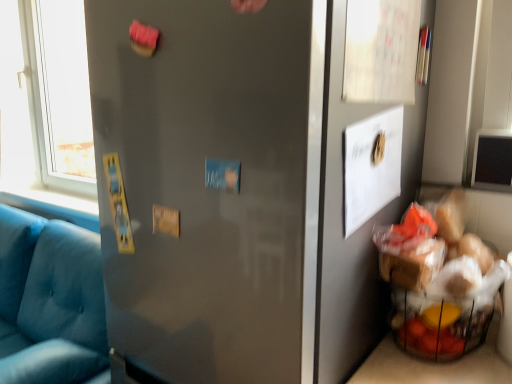
Question: Can you confirm if matte gray door at upper left is wider than matte blue fabric couch at left?

Choices:
 (A) yes
 (B) no

Answer: (B)

Question: Does matte gray door at upper left contain matte blue fabric couch at left?

Choices:
 (A) yes
 (B) no

Answer: (B)

Question: Could you tell me if matte gray door at upper left is facing matte blue fabric couch at left?

Choices:
 (A) yes
 (B) no

Answer: (B)

Question: Is matte gray door at upper left to the left of matte blue fabric couch at left from the viewer's perspective?

Choices:
 (A) no
 (B) yes

Answer: (A)

Question: From a real-world perspective, is matte gray door at upper left beneath matte blue fabric couch at left?

Choices:
 (A) no
 (B) yes

Answer: (A)

Question: Is matte gray door at upper left in contact with matte blue fabric couch at left?

Choices:
 (A) no
 (B) yes

Answer: (A)

Question: Is matte blue fabric couch at left located outside matte gray door at upper left?

Choices:
 (A) no
 (B) yes

Answer: (B)

Question: Is matte blue fabric couch at left smaller than matte gray door at upper left?

Choices:
 (A) yes
 (B) no

Answer: (B)

Question: Considering the relative sizes of matte blue fabric couch at left and matte gray door at upper left in the image provided, is matte blue fabric couch at left thinner than matte gray door at upper left?

Choices:
 (A) yes
 (B) no

Answer: (B)

Question: Does matte blue fabric couch at left have a larger size compared to matte gray door at upper left?

Choices:
 (A) yes
 (B) no

Answer: (A)

Question: Is matte blue fabric couch at left at the left side of matte gray door at upper left?

Choices:
 (A) no
 (B) yes

Answer: (B)

Question: Is matte gray door at upper left at the back of matte blue fabric couch at left?

Choices:
 (A) yes
 (B) no

Answer: (B)

Question: Is matte gray door at upper left inside or outside of matte blue fabric couch at left?

Choices:
 (A) outside
 (B) inside

Answer: (A)